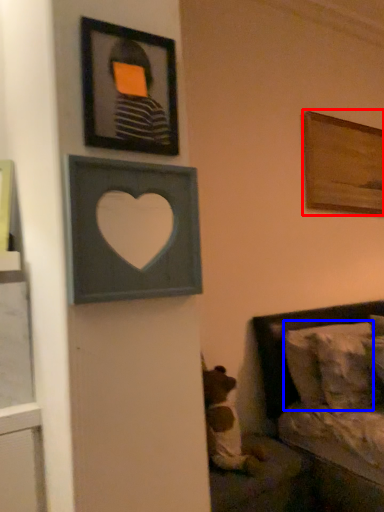
Question: Which object is closer to the camera taking this photo, picture frame (highlighted by a red box) or pillow (highlighted by a blue box)?

Choices:
 (A) picture frame
 (B) pillow

Answer: (B)